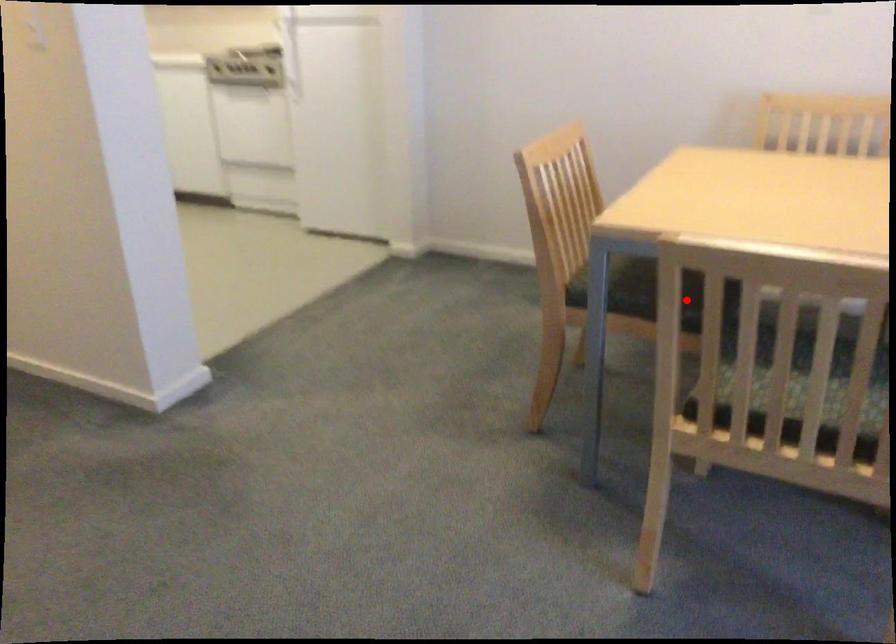
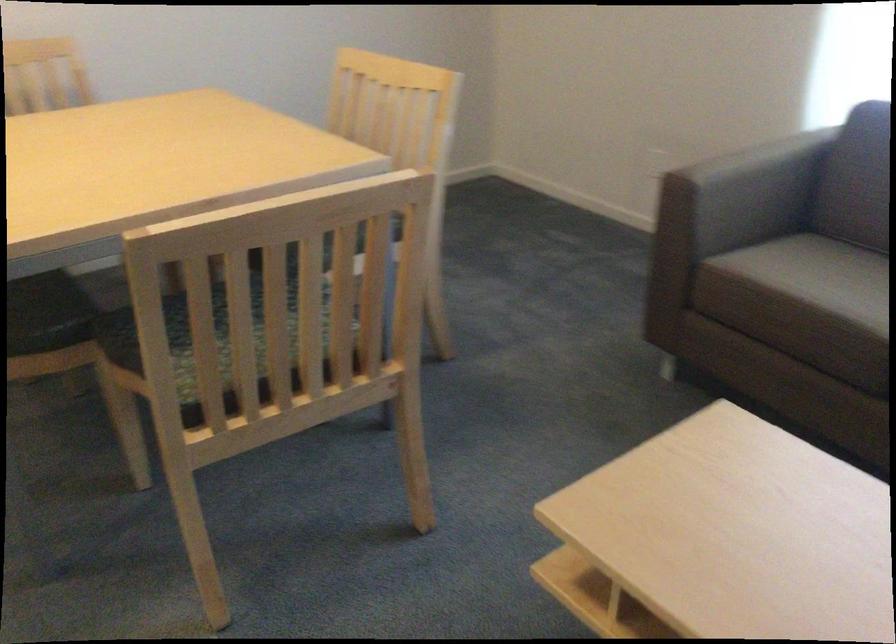
Question: A red point is marked in image1. In image2, is the corresponding 3D point closer to the camera or farther? Reply with the corresponding letter.

Choices:
 (A) The corresponding 3D point is closer.
 (B) The corresponding 3D point is farther.

Answer: (A)